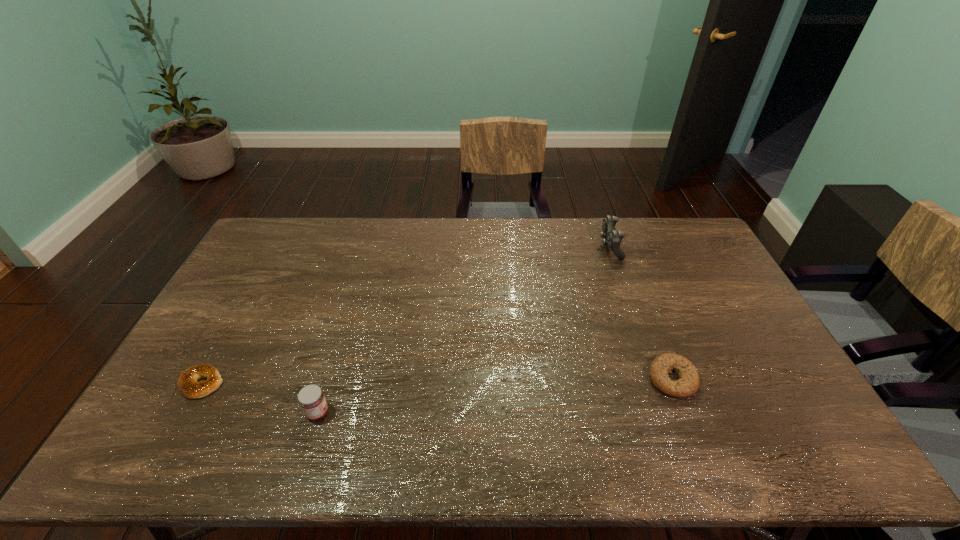
You are a GUI agent. You are given a task and a screenshot of the screen. Output one action in this format:
    pyautogui.click(x=<x>, y=<y>)
    Task: Click on the free space at the near left corner
    The width and height of the screenshot is (960, 540).
    Given the screenshot: What is the action you would take?
    pyautogui.click(x=196, y=437)

Locate an element on the screen. This screenshot has width=960, height=540. vacant space at the near right corner is located at coordinates coord(783,444).

Find the location of `free spot between the third shortest object and the tallest object`. free spot between the third shortest object and the tallest object is located at coordinates (464, 330).

Find the location of a particular element. free spot between the tallest object and the jam is located at coordinates (464, 330).

Image resolution: width=960 pixels, height=540 pixels. What are the coordinates of `free spot between the nearest object and the taller bagel` in the screenshot? It's located at (494, 396).

The image size is (960, 540). Find the location of `free area in between the left bagel and the tallest object`. free area in between the left bagel and the tallest object is located at coordinates (406, 315).

At what (x,y) coordinates should I click in order to perform the action: click on vacant area that lies between the second tallest object and the second shortest object. Please return your answer as a coordinate pair (x, y). Looking at the image, I should click on (494, 396).

This screenshot has height=540, width=960. Identify the location of vacant space that is in between the farthest object and the left bagel. (406, 315).

The height and width of the screenshot is (540, 960). Identify the location of free space between the left bagel and the taller bagel. (437, 381).

Where is `blank region between the shortest object and the taller bagel`? This screenshot has height=540, width=960. blank region between the shortest object and the taller bagel is located at coordinates (437, 381).